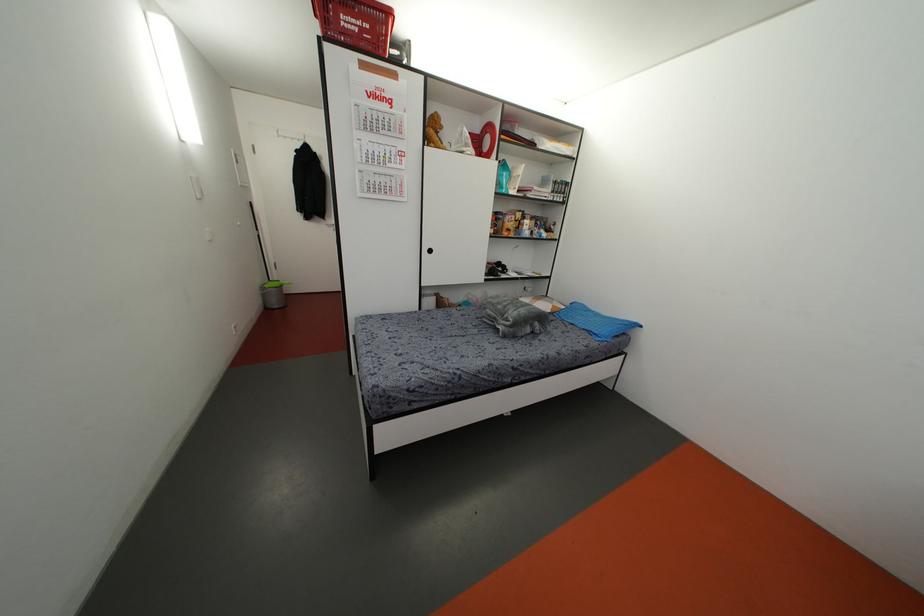
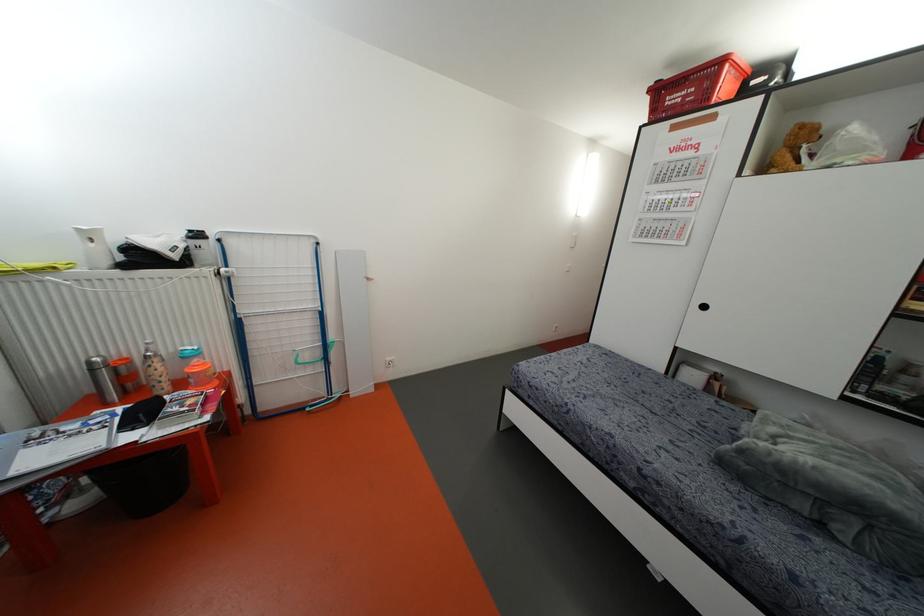
The point at (430, 251) is marked in the first image. Where is the corresponding point in the second image?

(703, 307)